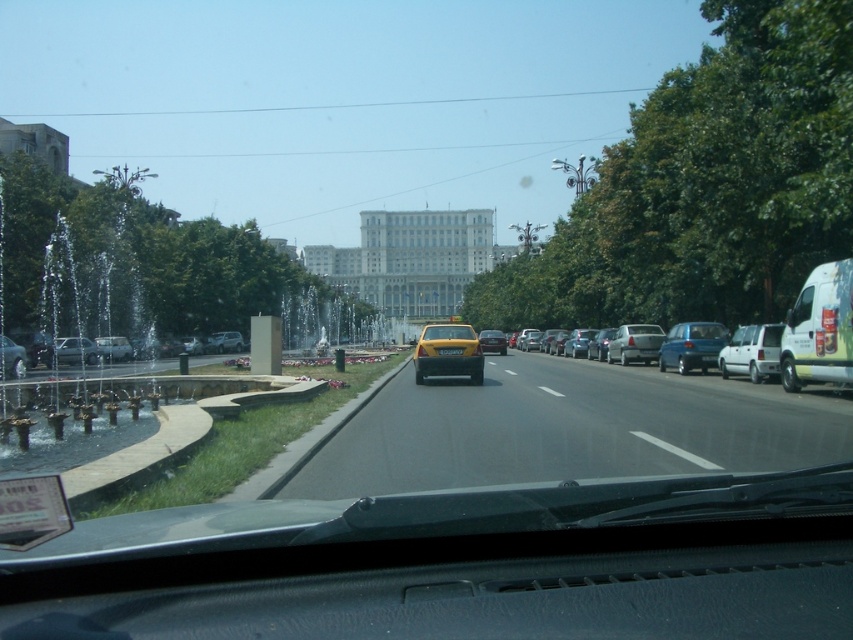
You are a passenger in a car and looking through the windshield. You see a metallic silver car at center and a yellow plastic license plate at center. Which object is closer to the left side of the road where the fountain is located?

The metallic silver car at center is to the left of the yellow plastic license plate at center, so it is closer to the left side of the road where the fountain is located.

You are driving a car and see the point at coordinates [677,369] in the image. If your car is 15 feet long, can you safely stop before reaching that point?

The point at coordinates [677,369] is 99.92 feet away from the viewer. Since the car is 15 feet long, there is sufficient distance to safely stop before reaching that point.

You are a passenger in the metallic silver car at center and want to read the yellow plastic license plate at center. Can you easily see it from your current position?

The metallic silver car at center is located below the yellow plastic license plate at center, so the license plate is above the car. Since you are inside the car, you can easily look up to see the yellow plastic license plate at center.